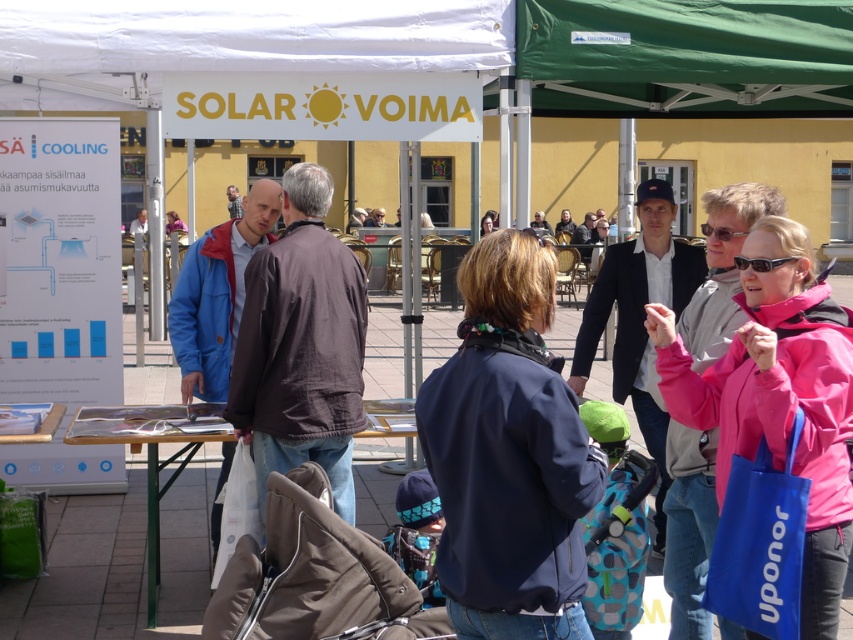
Question: Among these points, which one is nearest to the camera?

Choices:
 (A) (782, 45)
 (B) (235, 212)

Answer: (A)

Question: Which object appears farthest from the camera in this image?

Choices:
 (A) navy blue jacket at center
 (B) wooden table at center
 (C) light brown leather jacket at center

Answer: (C)

Question: Observing the image, what is the correct spatial positioning of white paper at left in reference to green fabric canopy at upper center?

Choices:
 (A) right
 (B) left

Answer: (B)

Question: Which point appears farthest from the camera in this image?

Choices:
 (A) (340, 525)
 (B) (633, 244)
 (C) (218, 531)

Answer: (B)

Question: Does brown fabric baby carriage at lower center appear under light brown leather jacket at center?

Choices:
 (A) yes
 (B) no

Answer: (A)

Question: Can you confirm if dark blue jacket at center is thinner than wooden table at center?

Choices:
 (A) yes
 (B) no

Answer: (A)